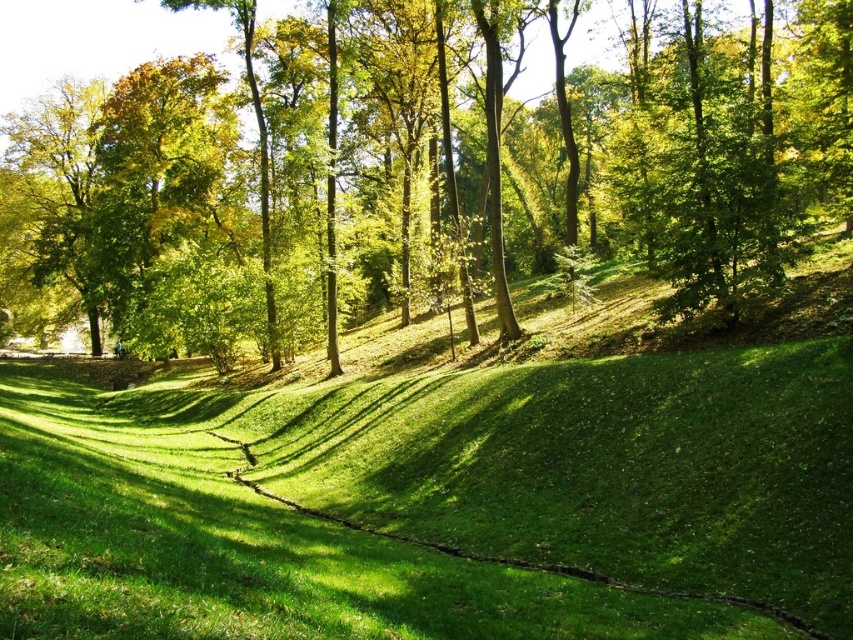
Consider the image. Is green leafy tree at upper center to the left of green grassy at center from the viewer's perspective?

Correct, you'll find green leafy tree at upper center to the left of green grassy at center.

Is point (173, 92) closer to viewer compared to point (433, 500)?

No, (173, 92) is behind (433, 500).

Locate an element on the screen. green leafy tree at upper center is located at coordinates (415, 170).